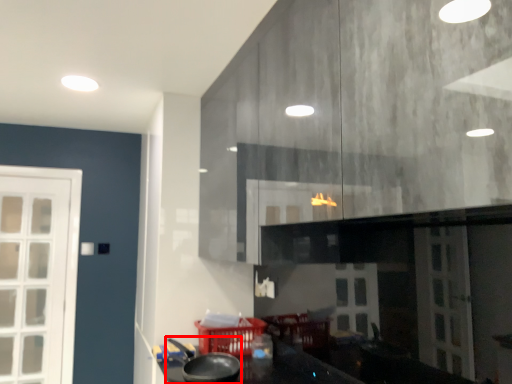
Question: Where is wok (annotated by the red box) located in relation to basket in the image?

Choices:
 (A) left
 (B) right

Answer: (A)